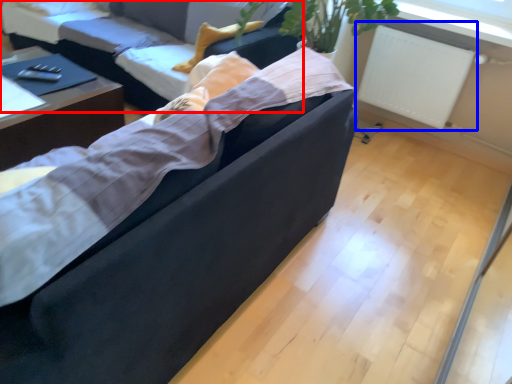
Question: Among these objects, which one is farthest to the camera, studio couch (highlighted by a red box) or radiator (highlighted by a blue box)?

Choices:
 (A) studio couch
 (B) radiator

Answer: (B)